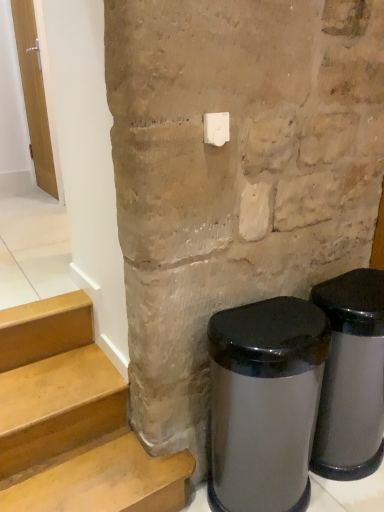
What do you see at coordinates (264, 403) in the screenshot? I see `satin silver trash can at lower right, acting as the second waste container starting from the right` at bounding box center [264, 403].

Identify the location of satin silver trash can at lower right, the second waste container from the left. This screenshot has height=512, width=384. (351, 377).

Locate an element on the screen. The width and height of the screenshot is (384, 512). white plastic light switch at upper center is located at coordinates (216, 128).

Is satin silver trash can at lower right, which is counted as the 1th waste container, starting from the left, bigger than white plastic light switch at upper center?

Correct, satin silver trash can at lower right, which is counted as the 1th waste container, starting from the left, is larger in size than white plastic light switch at upper center.

Is satin silver trash can at lower right, which is counted as the 1th waste container, starting from the left, oriented towards white plastic light switch at upper center?

No.

Is satin silver trash can at lower right, which is counted as the 1th waste container, starting from the left, positioned before white plastic light switch at upper center?

Yes, it is in front of white plastic light switch at upper center.

From their relative heights in the image, would you say satin silver trash can at lower right, which is counted as the 1th waste container, starting from the left, is taller or shorter than white plastic light switch at upper center?

Considering their sizes, satin silver trash can at lower right, which is counted as the 1th waste container, starting from the left, has more height than white plastic light switch at upper center.

Can you tell me how much wooden door at left and satin silver trash can at lower right, the second waste container from the left, differ in facing direction?

92 degrees separate the facing orientations of wooden door at left and satin silver trash can at lower right, the second waste container from the left.

Is wooden door at left not inside satin silver trash can at lower right, the second waste container from the left?

Yes, wooden door at left is outside of satin silver trash can at lower right, the second waste container from the left.

Which object is positioned more to the right, wooden door at left or satin silver trash can at lower right, which is the 1th waste container in right-to-left order?

From the viewer's perspective, satin silver trash can at lower right, which is the 1th waste container in right-to-left order, appears more on the right side.

Between white plastic light switch at upper center and satin silver trash can at lower right, which is the 1th waste container in right-to-left order, which one is positioned in front?

Positioned in front is white plastic light switch at upper center.

From a real-world perspective, is white plastic light switch at upper center on satin silver trash can at lower right, which is the 1th waste container in right-to-left order?

Yes, from a real-world perspective, white plastic light switch at upper center is over satin silver trash can at lower right, which is the 1th waste container in right-to-left order

Consider the image. Is white plastic light switch at upper center next to satin silver trash can at lower right, which is the 1th waste container in right-to-left order?

white plastic light switch at upper center and satin silver trash can at lower right, which is the 1th waste container in right-to-left order, are not in contact.

Does point (210, 116) lie in front of point (371, 279)?

Yes, it is.

Considering the positions of objects satin silver trash can at lower right, acting as the second waste container starting from the right, and satin silver trash can at lower right, which is the 1th waste container in right-to-left order, in the image provided, who is more to the left, satin silver trash can at lower right, acting as the second waste container starting from the right, or satin silver trash can at lower right, which is the 1th waste container in right-to-left order,?

Positioned to the left is satin silver trash can at lower right, acting as the second waste container starting from the right.

Is the surface of satin silver trash can at lower right, which is counted as the 1th waste container, starting from the left, in direct contact with satin silver trash can at lower right, which is the 1th waste container in right-to-left order?

They are not placed beside each other.

Consider the image. From the image's perspective, is satin silver trash can at lower right, which is counted as the 1th waste container, starting from the left, located above satin silver trash can at lower right, the second waste container from the left?

Incorrect, from the image's perspective, satin silver trash can at lower right, which is counted as the 1th waste container, starting from the left, is lower than satin silver trash can at lower right, the second waste container from the left.

Between wooden door at left and white plastic light switch at upper center, which one has smaller size?

Smaller between the two is white plastic light switch at upper center.

From the image's perspective, which is below, wooden door at left or white plastic light switch at upper center?

white plastic light switch at upper center is shown below in the image.

Which is correct: wooden door at left is inside white plastic light switch at upper center, or outside of it?

The correct answer is: outside.

From a real-world perspective, is wooden door at left beneath white plastic light switch at upper center?

Actually, wooden door at left is physically above white plastic light switch at upper center in the real world.

Is satin silver trash can at lower right, acting as the second waste container starting from the right, inside satin silver trash can at lower right, the second waste container from the left?

No, satin silver trash can at lower right, acting as the second waste container starting from the right, is not inside satin silver trash can at lower right, the second waste container from the left.

Measure the distance from satin silver trash can at lower right, which is the 1th waste container in right-to-left order, to satin silver trash can at lower right, acting as the second waste container starting from the right.

They are 9.60 inches apart.

Does satin silver trash can at lower right, which is the 1th waste container in right-to-left order, turn towards satin silver trash can at lower right, acting as the second waste container starting from the right?

No, satin silver trash can at lower right, which is the 1th waste container in right-to-left order, is not turned towards satin silver trash can at lower right, acting as the second waste container starting from the right.

Considering the sizes of objects satin silver trash can at lower right, the second waste container from the left, and satin silver trash can at lower right, which is counted as the 1th waste container, starting from the left, in the image provided, who is thinner, satin silver trash can at lower right, the second waste container from the left, or satin silver trash can at lower right, which is counted as the 1th waste container, starting from the left,?

Thinner between the two is satin silver trash can at lower right, the second waste container from the left.

Is satin silver trash can at lower right, the second waste container from the left, positioned beyond the bounds of wooden door at left?

satin silver trash can at lower right, the second waste container from the left, lies outside wooden door at left's area.

From the image's perspective, is satin silver trash can at lower right, which is the 1th waste container in right-to-left order, on top of wooden door at left?

Actually, satin silver trash can at lower right, which is the 1th waste container in right-to-left order, appears below wooden door at left in the image.

Is satin silver trash can at lower right, the second waste container from the left, looking in the opposite direction of wooden door at left?

That's right, satin silver trash can at lower right, the second waste container from the left, is facing away from wooden door at left.

At what (x,y) coordinates should I click in order to perform the action: click on light switch on the left of the satin silver trash can at lower right, acting as the second waste container starting from the right. Please return your answer as a coordinate pair (x, y). Looking at the image, I should click on (216, 128).

The height and width of the screenshot is (512, 384). I want to click on the 2nd waste container counting from the right of the wooden door at left, so click(x=351, y=377).

Based on their spatial positions, is satin silver trash can at lower right, acting as the second waste container starting from the right, or white plastic light switch at upper center further from satin silver trash can at lower right, the second waste container from the left?

white plastic light switch at upper center is further to satin silver trash can at lower right, the second waste container from the left.

Considering their positions, is white plastic light switch at upper center positioned further to satin silver trash can at lower right, the second waste container from the left, than wooden door at left?

wooden door at left lies further to satin silver trash can at lower right, the second waste container from the left, than the other object.

When comparing their distances from satin silver trash can at lower right, the second waste container from the left, does white plastic light switch at upper center or satin silver trash can at lower right, acting as the second waste container starting from the right, seem further?

The object further to satin silver trash can at lower right, the second waste container from the left, is white plastic light switch at upper center.

In the scene shown: Looking at the image, which one is located further to wooden door at left, satin silver trash can at lower right, which is counted as the 1th waste container, starting from the left, or white plastic light switch at upper center?

satin silver trash can at lower right, which is counted as the 1th waste container, starting from the left.

Looking at the image, which one is located further to satin silver trash can at lower right, which is counted as the 1th waste container, starting from the left, satin silver trash can at lower right, the second waste container from the left, or wooden door at left?

wooden door at left is positioned further to the anchor satin silver trash can at lower right, which is counted as the 1th waste container, starting from the left.

From the image, which object appears to be farther from satin silver trash can at lower right, acting as the second waste container starting from the right, white plastic light switch at upper center or satin silver trash can at lower right, which is the 1th waste container in right-to-left order?

white plastic light switch at upper center is positioned further to the anchor satin silver trash can at lower right, acting as the second waste container starting from the right.

From the image, which object appears to be nearer to satin silver trash can at lower right, the second waste container from the left, wooden door at left or white plastic light switch at upper center?

Based on the image, white plastic light switch at upper center appears to be nearer to satin silver trash can at lower right, the second waste container from the left.

Estimate the real-world distances between objects in this image. Which object is closer to satin silver trash can at lower right, acting as the second waste container starting from the right, wooden door at left or satin silver trash can at lower right, which is the 1th waste container in right-to-left order?

satin silver trash can at lower right, which is the 1th waste container in right-to-left order, lies closer to satin silver trash can at lower right, acting as the second waste container starting from the right, than the other object.

In order to click on light switch located between satin silver trash can at lower right, which is counted as the 1th waste container, starting from the left, and wooden door at left in the depth direction in this screenshot , I will do `click(216, 128)`.

Where is `light switch situated between wooden door at left and satin silver trash can at lower right, which is the 1th waste container in right-to-left order, from left to right`? Image resolution: width=384 pixels, height=512 pixels. light switch situated between wooden door at left and satin silver trash can at lower right, which is the 1th waste container in right-to-left order, from left to right is located at coordinates (216, 128).

In order to click on waste container between wooden door at left and satin silver trash can at lower right, the second waste container from the left, in the horizontal direction in this screenshot , I will do `click(264, 403)`.

Find the location of a particular element. The image size is (384, 512). waste container between white plastic light switch at upper center and satin silver trash can at lower right, which is counted as the 1th waste container, starting from the left, vertically is located at coordinates (351, 377).